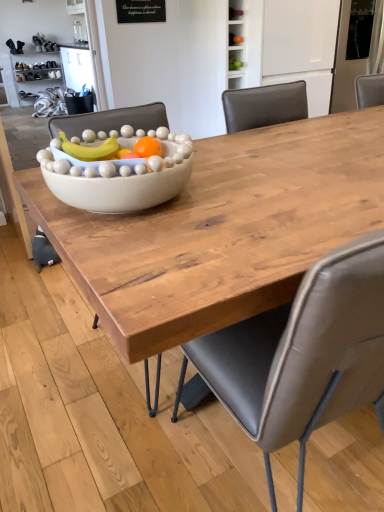
The width and height of the screenshot is (384, 512). In order to click on free location in front of white glossy bowl at center in this screenshot , I will do `click(173, 252)`.